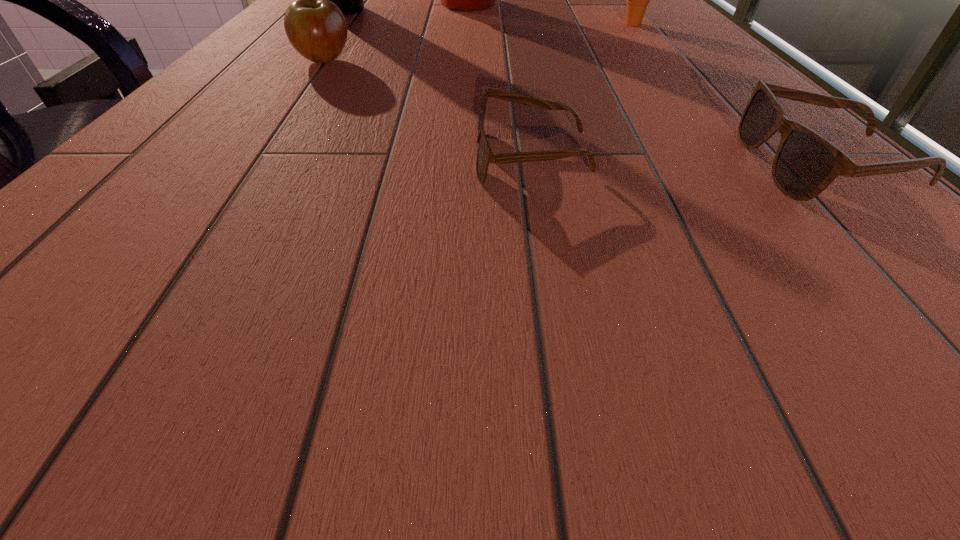
Observe the arrangement of all sunglassess in the image. To keep them evenly spaced, where would you place another sunglasses on the left? Please locate a free space. Please provide its 2D coordinates. Your answer should be formatted as a tuple, i.e. [(x, y)], where the tuple contains the x and y coordinates of a point satisfying the conditions above.

[(253, 148)]